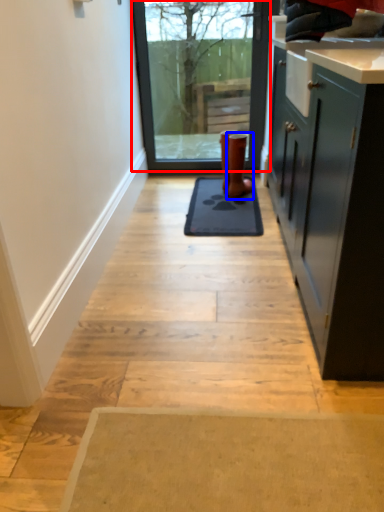
Question: Which of the following is the closest to the observer, window (highlighted by a red box) or footwear (highlighted by a blue box)?

Choices:
 (A) window
 (B) footwear

Answer: (B)